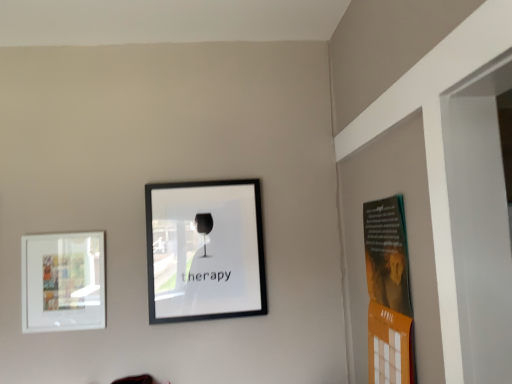
Question: In the image, is black matte picture frame at center, the 2th picture frame positioned from the left, on the left side or the right side of white matte picture frame at left, acting as the second picture frame starting from the right?

Choices:
 (A) right
 (B) left

Answer: (A)

Question: Is black matte picture frame at center, acting as the first picture frame starting from the right, spatially inside white matte picture frame at left, positioned as the first picture frame in left-to-right order, or outside of it?

Choices:
 (A) inside
 (B) outside

Answer: (B)

Question: Considering their positions, is black matte picture frame at center, acting as the first picture frame starting from the right, located in front of or behind white matte picture frame at left, acting as the second picture frame starting from the right?

Choices:
 (A) behind
 (B) front

Answer: (A)

Question: Is white matte picture frame at left, positioned as the first picture frame in left-to-right order, spatially inside black matte picture frame at center, the 2th picture frame positioned from the left, or outside of it?

Choices:
 (A) inside
 (B) outside

Answer: (B)

Question: In terms of size, does white matte picture frame at left, positioned as the first picture frame in left-to-right order, appear bigger or smaller than black matte picture frame at center, acting as the first picture frame starting from the right?

Choices:
 (A) big
 (B) small

Answer: (B)

Question: Is white matte picture frame at left, positioned as the first picture frame in left-to-right order, taller or shorter than black matte picture frame at center, acting as the first picture frame starting from the right?

Choices:
 (A) tall
 (B) short

Answer: (B)

Question: From a real-world perspective, is white matte picture frame at left, acting as the second picture frame starting from the right, positioned above or below black matte picture frame at center, acting as the first picture frame starting from the right?

Choices:
 (A) above
 (B) below

Answer: (B)